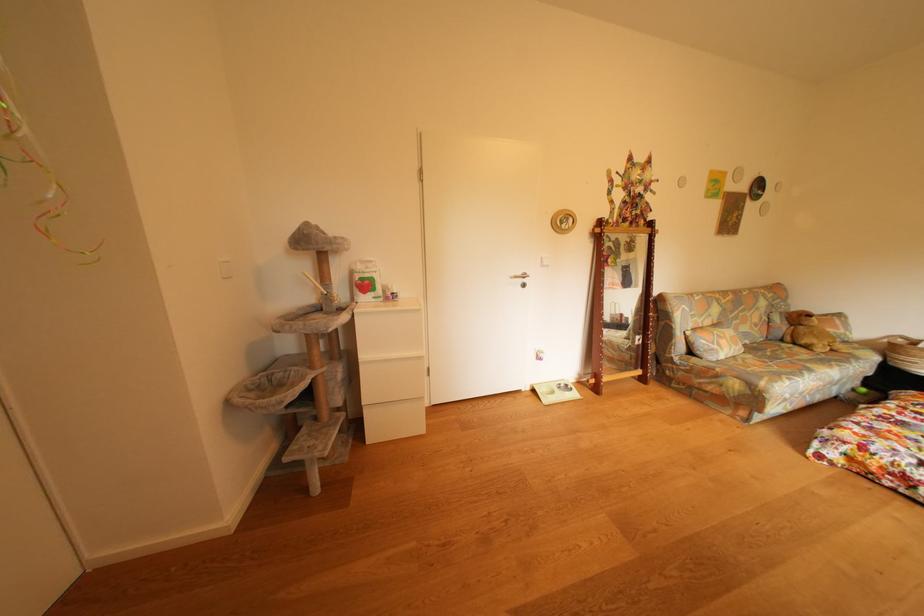
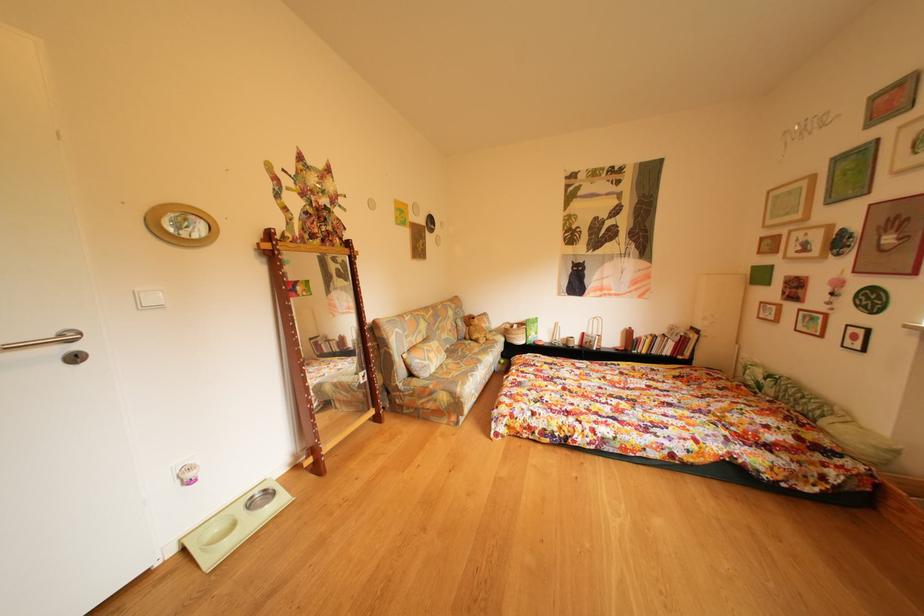
Question: Based on the continuous images, in which direction is the camera rotating? Reply with the corresponding letter.

Choices:
 (A) Left
 (B) Right
 (C) Up
 (D) Down

Answer: (B)